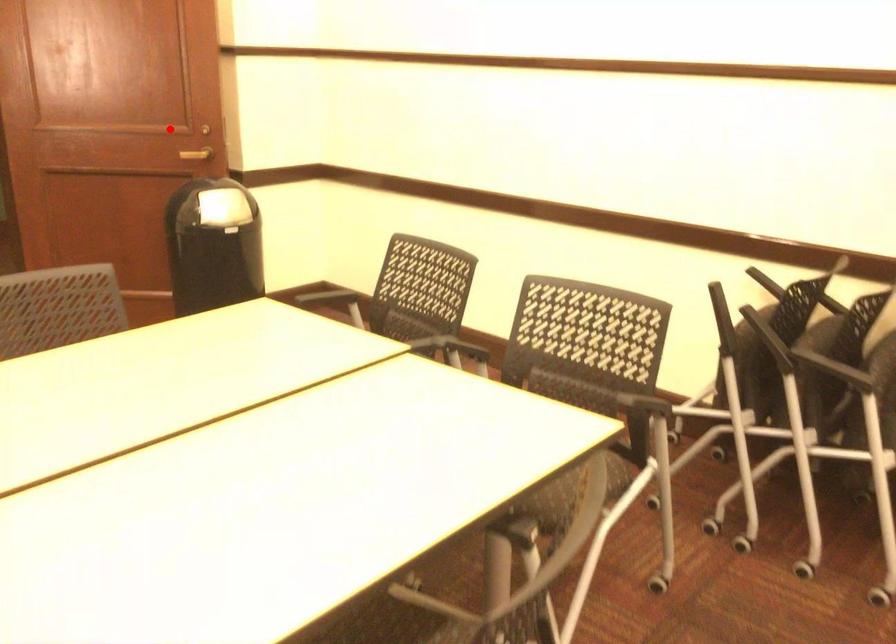
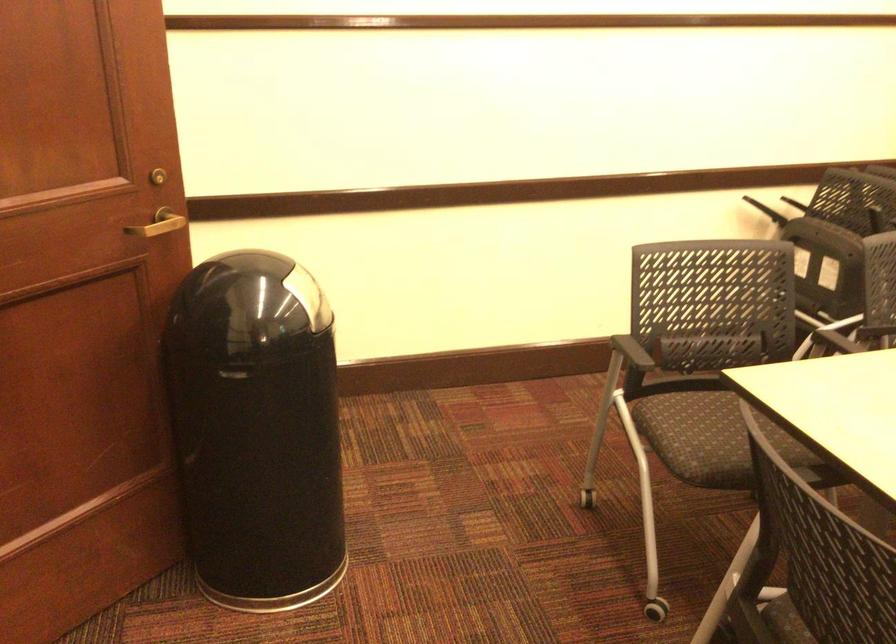
In the second image, find the point that corresponds to the highlighted location in the first image.

(158, 223)